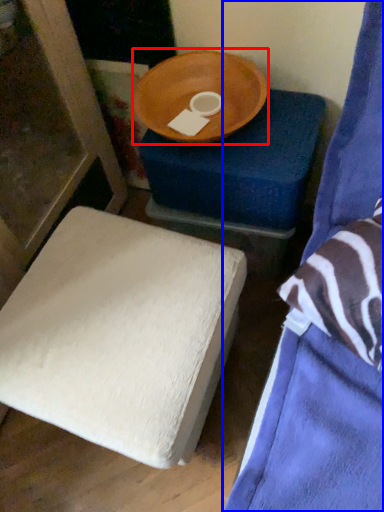
Question: Which point is closer to the camera, round table (highlighted by a red box) or furniture (highlighted by a blue box)?

Choices:
 (A) round table
 (B) furniture

Answer: (B)